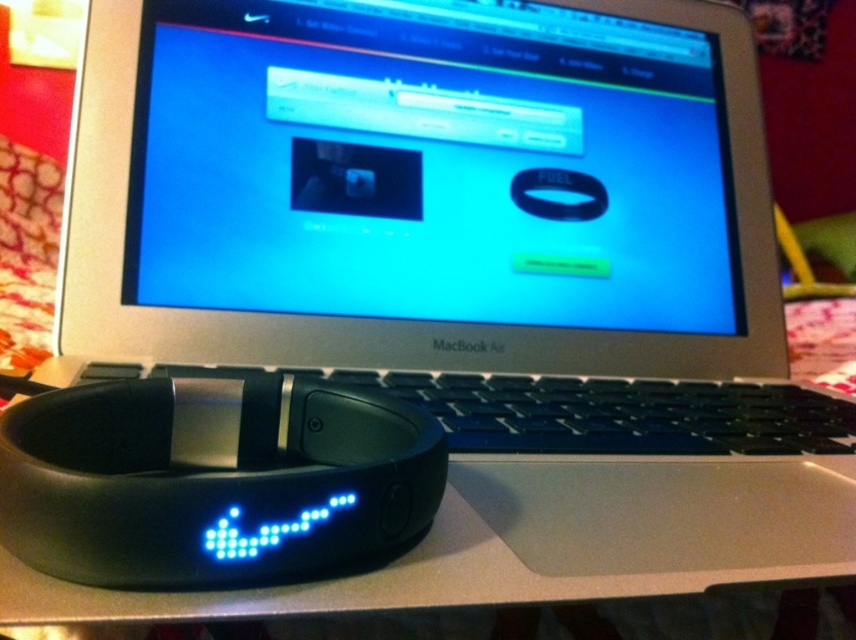
You are a customer looking to buy a Nike FuelBand. You see the black matte wristband at lower left and the black matte nike fuelband at lower left in the image. Which one is the actual Nike FuelBand product?

The black matte Nike FuelBand at lower left is the actual product, while the black matte wristband at lower left is larger in size and likely a different item.

From the picture: You are a customer looking at the black matte wristband at lower left and the black matte nike fuelband at lower left on the laptop keyboard. Which one is more to the right?

The black matte wristband at lower left is positioned on the right side of the black matte nike fuelband at lower left, so it is more to the right.

You are a photographer setting up a shot of the black matte wristband at lower left and the black matte nike fuelband at lower left. You want to ensure both items are in focus. Since the wristband is closer, will you need to adjust your camera focus to capture both clearly?

The black matte wristband at lower left is closer to the viewer than the black matte nike fuelband at lower left. To capture both in focus, you should adjust the camera focus to account for the distance between them.